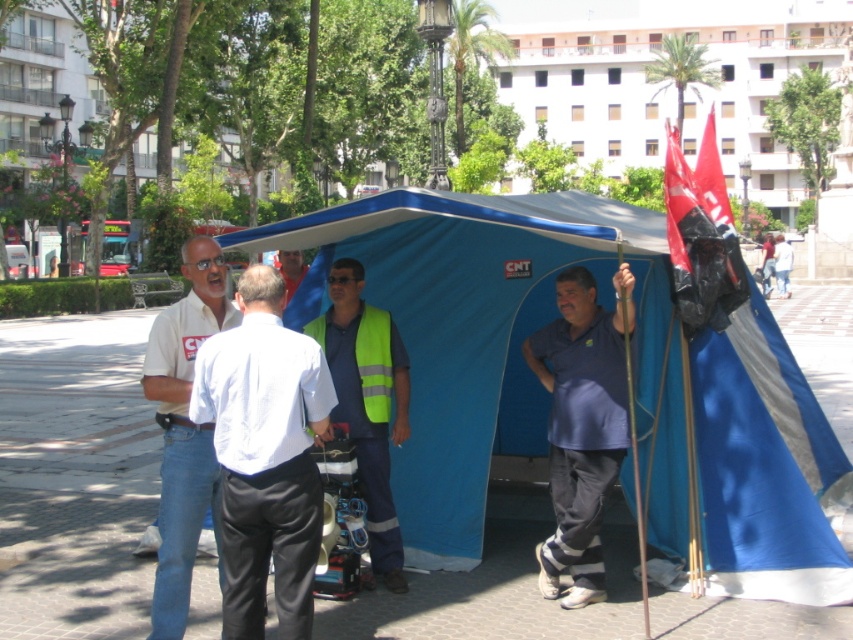
In the scene shown: You are a photographer trying to capture a group photo of the people at the event. You want to ensure that both the white smooth shirt at left and the yellow reflective safety vest at center are visible in the frame. Based on their positions, which side of the frame should you focus on to include both?

To include both the white smooth shirt at left and the yellow reflective safety vest at center in the frame, focus on the left side of the frame since the white smooth shirt at left is positioned on the left side of the yellow reflective safety vest at center.

You are a photographer trying to capture a photo of the blue fabric tent at right and the light blue shirt at center. Based on their heights, which object should you focus on first to ensure both are in frame?

The blue fabric tent at right is shorter than the light blue shirt at center, so you should focus on the light blue shirt at center first to ensure both are in frame.